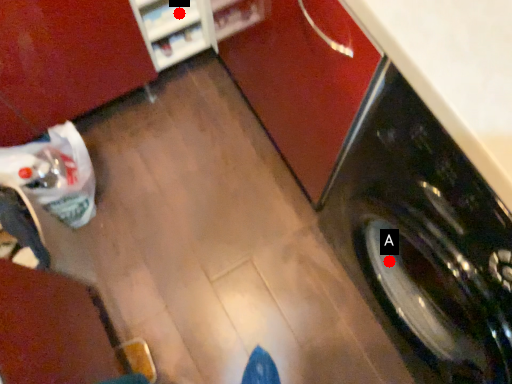
Question: Two points are circled on the image, labeled by A and B beside each circle. Which point is farther to the camera?

Choices:
 (A) A is further
 (B) B is further

Answer: (B)